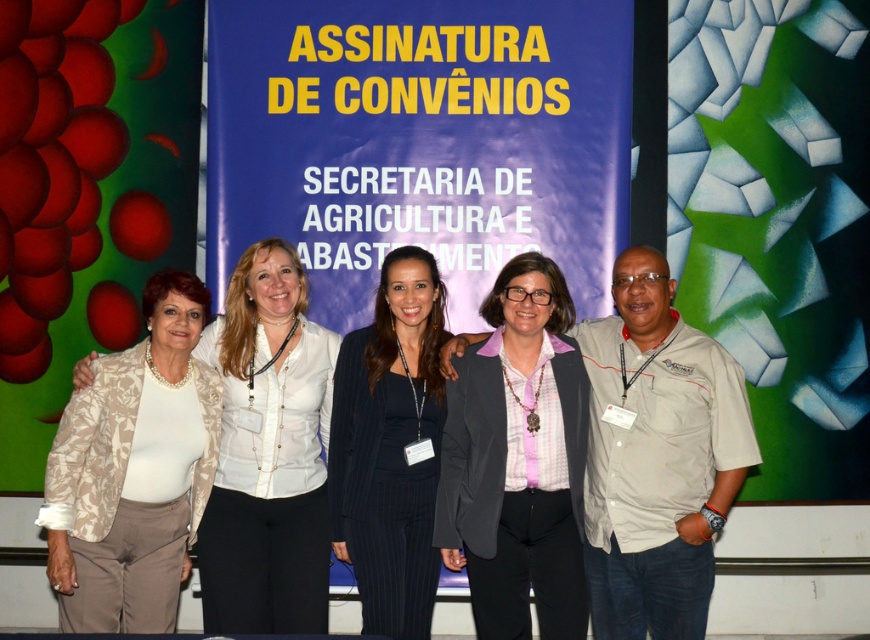
Does pink fabric shirt at center lie in front of beige textured blazer at left?

Yes, pink fabric shirt at center is in front of beige textured blazer at left.

How much distance is there between pink fabric shirt at center and beige textured blazer at left?

A distance of 3.93 meters exists between pink fabric shirt at center and beige textured blazer at left.

Describe the element at coordinates (519, 460) in the screenshot. I see `pink fabric shirt at center` at that location.

This screenshot has height=640, width=870. I want to click on pink fabric shirt at center, so click(519, 460).

Between pink fabric shirt at center and black pinstripe suit at center, which one is positioned lower?

pink fabric shirt at center is lower down.

How distant is pink fabric shirt at center from black pinstripe suit at center?

pink fabric shirt at center and black pinstripe suit at center are 4.38 feet apart.

Where is `pink fabric shirt at center`? This screenshot has height=640, width=870. pink fabric shirt at center is located at coordinates (519, 460).

How far apart are beige floral blazer at left and beige textured blazer at left?

1.88 meters

Who is more distant from viewer, [146,604] or [306,561]?

The point [306,561] is behind.

Describe the element at coordinates (135, 470) in the screenshot. I see `beige floral blazer at left` at that location.

Locate an element on the screen. beige floral blazer at left is located at coordinates coord(135,470).